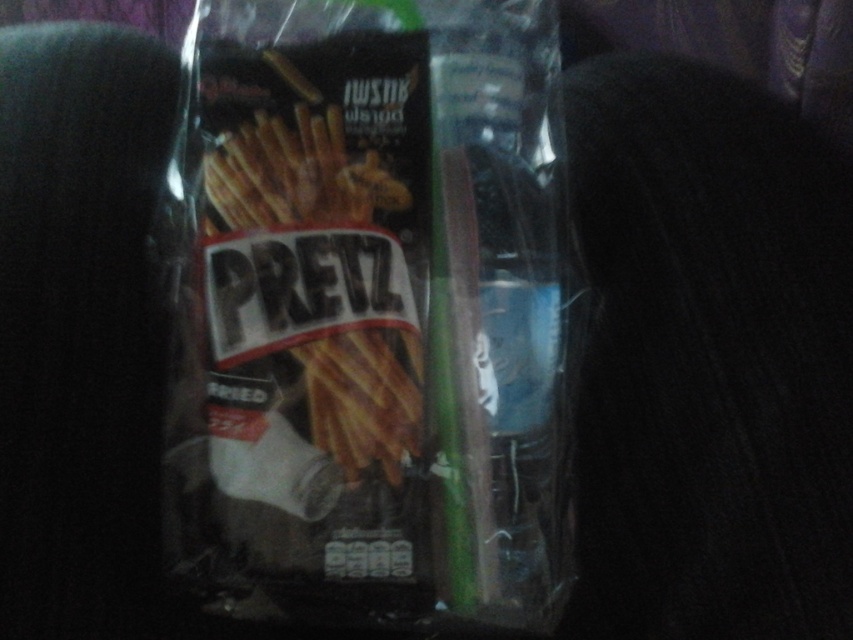
Is matte plastic bag at center shorter than matte brown french fries at center?

In fact, matte plastic bag at center may be taller than matte brown french fries at center.

Image resolution: width=853 pixels, height=640 pixels. What do you see at coordinates (370, 314) in the screenshot? I see `matte plastic bag at center` at bounding box center [370, 314].

The height and width of the screenshot is (640, 853). I want to click on matte plastic bag at center, so click(x=370, y=314).